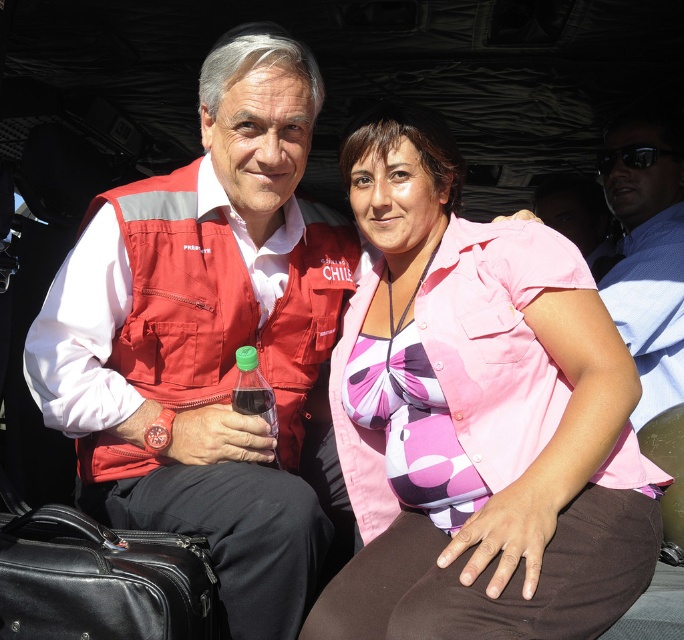
You are a photographer trying to capture a portrait of the two people in the scene. You need to ensure that both the matte red vest at center and the black leather suitcase at lower left are visible in the frame. Given their sizes, which object will require more space in the composition?

The matte red vest at center is larger in size than the black leather suitcase at lower left, so it will require more space in the composition.

You are a photographer standing in front of the two people in the scene. You need to take a photo that includes both the pink fabric shirt at center and the black leather suitcase at lower left. However, your camera has a limited field of view. Based on their sizes, do you think you can fit both objects into the frame without moving the camera?

The pink fabric shirt at center might be wider than black leather suitcase at lower left, so there is a possibility that the shirt takes up more space in the frame. However, since the suitcase is positioned at lower left and the shirt is at center, adjusting the camera angle slightly to include both might be feasible. But without knowing the exact dimensions of the camera field of view, it is uncertain. The description only states a possible size difference, not their exact positions relative to the camera.

You are standing in front of the image and want to describe the exact location of the pink fabric shirt at center. What are its coordinates?

The pink fabric shirt at center is located at coordinates point (477, 417).